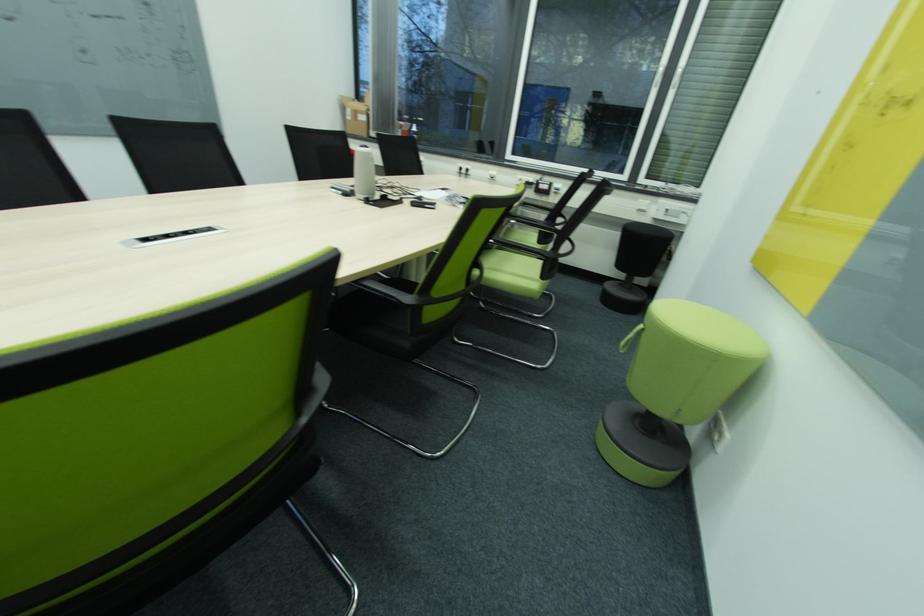
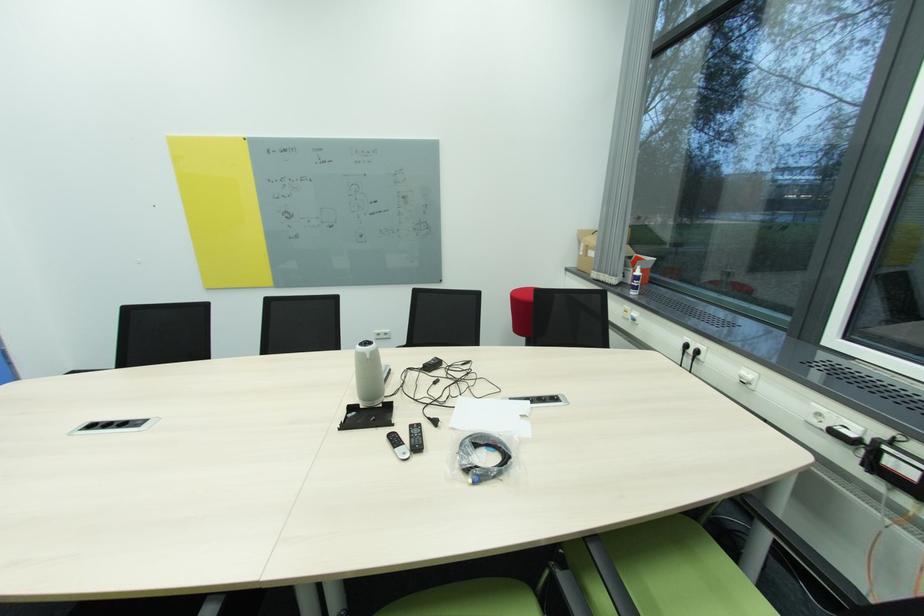
In the second image, find the point that corresponds to the point at 419,132 in the first image.

(639, 277)